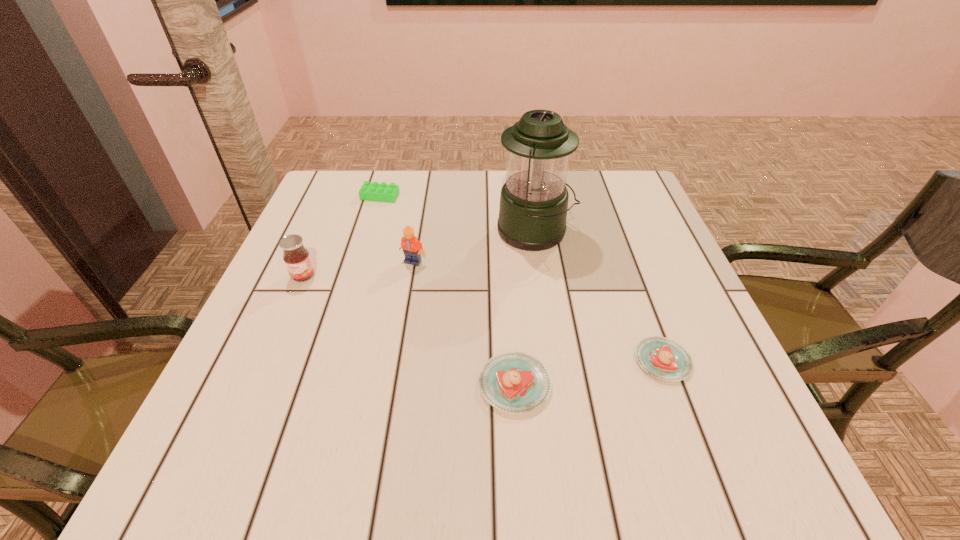
Where is `the left pastry`? the left pastry is located at coordinates (513, 382).

Locate an element on the screen. the right pastry is located at coordinates (660, 357).

This screenshot has width=960, height=540. In order to click on the rightmost object in this screenshot , I will do `click(660, 357)`.

You are a GUI agent. You are given a task and a screenshot of the screen. Output one action in this format:
    pyautogui.click(x=<x>, y=<y>)
    Task: Click on the farthest object
    
    Given the screenshot: What is the action you would take?
    pyautogui.click(x=383, y=192)

The width and height of the screenshot is (960, 540). In order to click on the shorter Lego in this screenshot , I will do `click(383, 192)`.

Image resolution: width=960 pixels, height=540 pixels. What are the coordinates of `the tallest object` in the screenshot? It's located at (533, 208).

Where is `lantern`? This screenshot has width=960, height=540. lantern is located at coordinates (533, 208).

At what (x,y) coordinates should I click in order to perform the action: click on the leftmost object. Please return your answer as a coordinate pair (x, y). This screenshot has height=540, width=960. Looking at the image, I should click on click(296, 257).

Where is `the fourth farthest object`? This screenshot has height=540, width=960. the fourth farthest object is located at coordinates (296, 257).

Where is `the nearer Lego`? the nearer Lego is located at coordinates (412, 248).